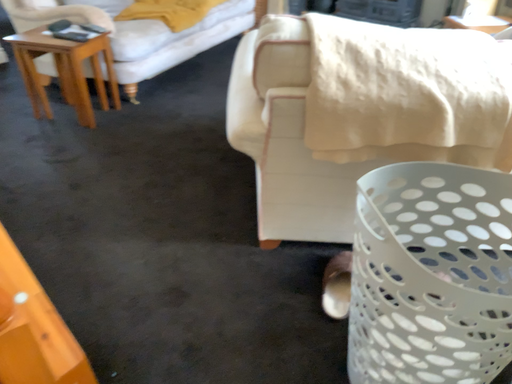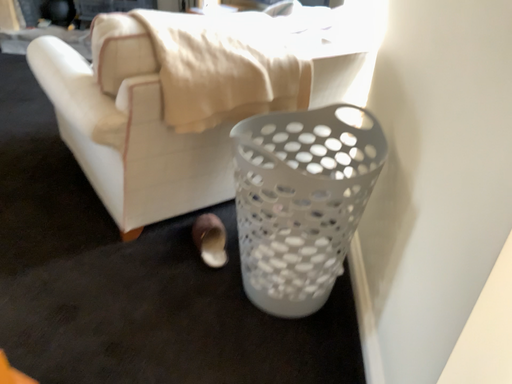
Question: Which way did the camera rotate in the video?

Choices:
 (A) rotated left
 (B) rotated right

Answer: (B)